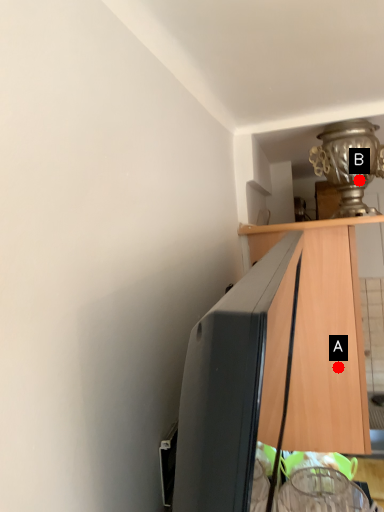
Question: Two points are circled on the image, labeled by A and B beside each circle. Which point is farther to the camera?

Choices:
 (A) A is further
 (B) B is further

Answer: (A)